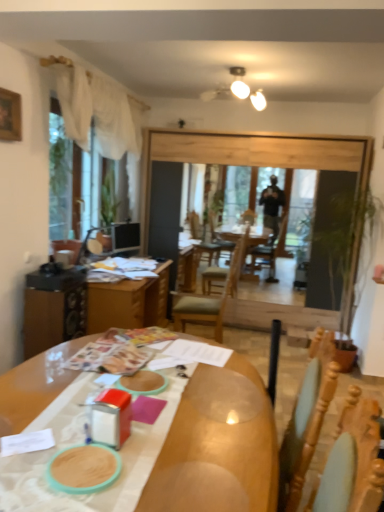
Identify the location of wooden chair at center. (211, 297).

Where is `wooden table at center`? wooden table at center is located at coordinates (94, 309).

Where is `wooden chair at center`? wooden chair at center is located at coordinates (211, 297).

Between matte black monitor at left and wooden table at center, which one has more height?

wooden table at center.

From a real-world perspective, is matte black monitor at left positioned above or below wooden table at center?

From a real-world perspective, matte black monitor at left is physically above wooden table at center.

Does matte black monitor at left turn towards wooden table at center?

No, matte black monitor at left is not oriented towards wooden table at center.

Find the location of a particular element. Image resolution: width=384 pixels, height=512 pixels. desk that appears in front of the matte black monitor at left is located at coordinates (218, 447).

Is wooden table at center outside of matte black monitor at left?

Yes, wooden table at center is located beyond the bounds of matte black monitor at left.

Considering the relative positions of wooden table at center and matte black monitor at left in the image provided, is wooden table at center to the left of matte black monitor at left from the viewer's perspective?

In fact, wooden table at center is to the right of matte black monitor at left.

How far apart are wooden table at center and matte black monitor at left?

wooden table at center and matte black monitor at left are 1.40 meters apart.

Is point (143, 311) positioned after point (112, 249)?

No, it is in front of (112, 249).

From a real-world perspective, relative to wooden table at center, is wooden chair at center vertically above or below?

Clearly, from a real-world perspective, wooden chair at center is above wooden table at center.

Is wooden table at center at the back of wooden chair at center?

No, wooden chair at center's orientation is not away from wooden table at center.

Between wooden chair at center and wooden table at center, which one is positioned in front?

wooden table at center.

Is point (176, 320) positioned in front of point (60, 316)?

No.

Considering the relative positions of wooden chair at center and wooden table at center in the image provided, is wooden chair at center to the left or to the right of wooden table at center?

Clearly, wooden chair at center is on the right of wooden table at center in the image.

The width and height of the screenshot is (384, 512). In the image, there is a wooden chair at center. Find the location of `desk below it (from a real-world perspective)`. desk below it (from a real-world perspective) is located at coordinates (218, 447).

Is wooden chair at center shorter than wooden table at center?

No.

From a real-world perspective, between wooden chair at center and wooden table at center, who is vertically lower?

wooden table at center is physically lower.

Identify the location of chair that appears below the matte black monitor at left (from the image's perspective). The image size is (384, 512). (211, 297).

Which of these two, matte black monitor at left or wooden chair at center, is bigger?

Bigger between the two is wooden chair at center.

Does matte black monitor at left have a lesser width compared to wooden chair at center?

Yes, matte black monitor at left is thinner than wooden chair at center.

Is matte black monitor at left to the right of wooden chair at center from the viewer's perspective?

No, matte black monitor at left is not to the right of wooden chair at center.

Is transparent glass window screen at left positioned behind wooden chair at center?

No, transparent glass window screen at left is closer to the camera.

Considering the relative sizes of transparent glass window screen at left and wooden chair at center in the image provided, is transparent glass window screen at left taller than wooden chair at center?

Indeed, transparent glass window screen at left has a greater height compared to wooden chair at center.

Is transparent glass window screen at left situated inside wooden chair at center or outside?

transparent glass window screen at left is not inside wooden chair at center, it's outside.

Is point (70, 210) closer or farther from the camera than point (179, 298)?

Point (70, 210) appears to be closer to the viewer than point (179, 298).

Can we say transparent glass window screen at left lies outside wooden table at center?

Indeed, transparent glass window screen at left is completely outside wooden table at center.

Which is nearer, [52,188] or [92,318]?

The point [92,318] is closer.

How different are the orientations of transparent glass window screen at left and wooden table at center in degrees?

The angle between the facing direction of transparent glass window screen at left and the facing direction of wooden table at center is 0.966 degrees.

Where is `desk beneath the matte black monitor at left (from a real-world perspective)`? Image resolution: width=384 pixels, height=512 pixels. desk beneath the matte black monitor at left (from a real-world perspective) is located at coordinates (218, 447).

I want to click on television above the wooden table at center (from the image's perspective), so click(125, 236).

From the picture: Which object lies nearer to the anchor point wooden picture frame at upper left, wooden table at center or wooden chair at center?

The object closer to wooden picture frame at upper left is wooden chair at center.

Estimate the real-world distances between objects in this image. Which object is further from wooden table at center, wooden chair at center or transparent glass window screen at left?

transparent glass window screen at left is further to wooden table at center.

Considering their positions, is wooden chair at center positioned closer to wooden table at center than wooden picture frame at upper left?

wooden picture frame at upper left is positioned closer to the anchor wooden table at center.

Which object lies nearer to the anchor point wooden table at center, wooden chair at center or wooden picture frame at upper left?

wooden chair at center is closer to wooden table at center.

Considering their positions, is wooden picture frame at upper left positioned closer to matte black monitor at left than wooden table at center?

wooden table at center is positioned closer to the anchor matte black monitor at left.

Looking at the image, which one is located further to wooden chair at center, transparent glass window screen at left or wooden table at center?

The object further to wooden chair at center is transparent glass window screen at left.

Estimate the real-world distances between objects in this image. Which object is further from wooden chair at center, wooden picture frame at upper left or transparent glass window screen at left?

wooden picture frame at upper left.

Looking at the image, which one is located further to wooden table at center, transparent glass window screen at left or matte black monitor at left?

matte black monitor at left lies further to wooden table at center than the other object.

Where is `picture frame between wooden table at center and wooden chair at center in the front-back direction`? picture frame between wooden table at center and wooden chair at center in the front-back direction is located at coordinates (10, 116).

You are a GUI agent. You are given a task and a screenshot of the screen. Output one action in this format:
    pyautogui.click(x=<x>, y=<y>)
    Task: Click on the chair between transparent glass window screen at left and wooden table at center from top to bottom
    
    Given the screenshot: What is the action you would take?
    click(211, 297)

I want to click on chair between wooden table at center and matte black monitor at left in the front-back direction, so click(x=211, y=297).

This screenshot has width=384, height=512. Identify the location of television that lies between transparent glass window screen at left and wooden table at center from top to bottom. [x=125, y=236].